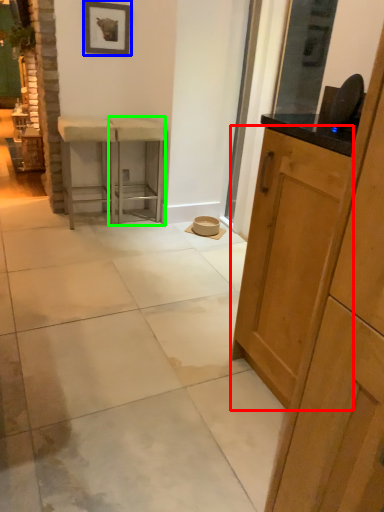
Question: Which object is the closest to the cabinetry (highlighted by a red box)? Choose among these: picture frame (highlighted by a blue box) or stool (highlighted by a green box).

Choices:
 (A) picture frame
 (B) stool

Answer: (B)